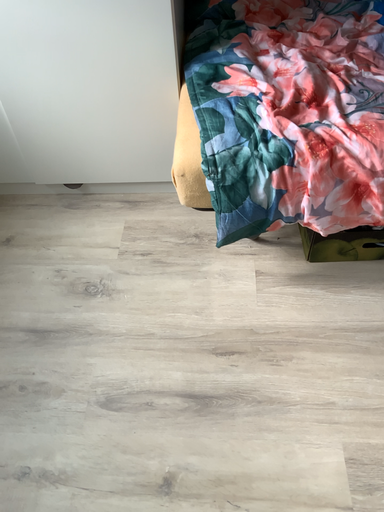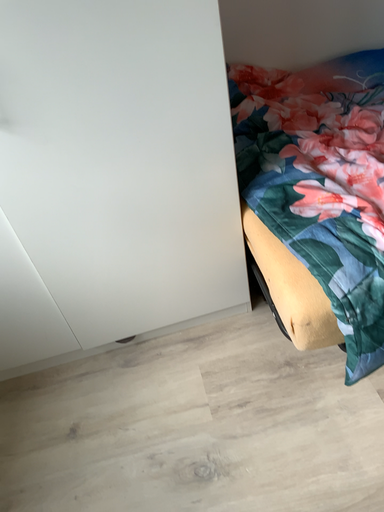
Question: How did the camera likely rotate when shooting the video?

Choices:
 (A) rotated downward
 (B) rotated upward

Answer: (B)